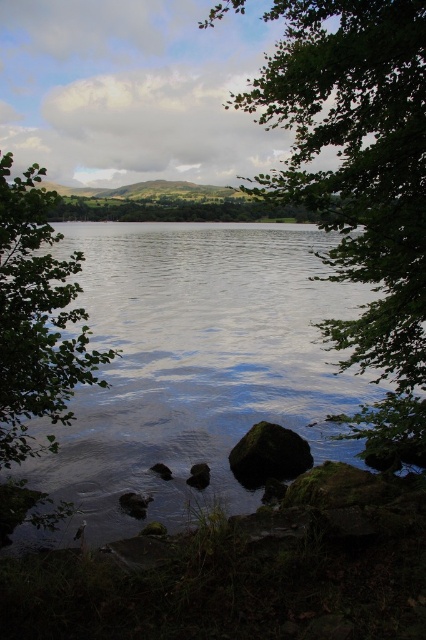
You are standing at the lakeside and want to locate the point at coordinates (x=360, y=184). According to the scene, where exactly is this point located?

The point at coordinates (x=360, y=184) is on the green leafy tree at center.

You are standing at the center of the image. Looking towards the green leafy tree at left, in which direction relative to your position is the tree located?

The green leafy tree at left is located to the left side of the center position, as its 2D coordinates at point (37, 320) place it in the left half of the image.